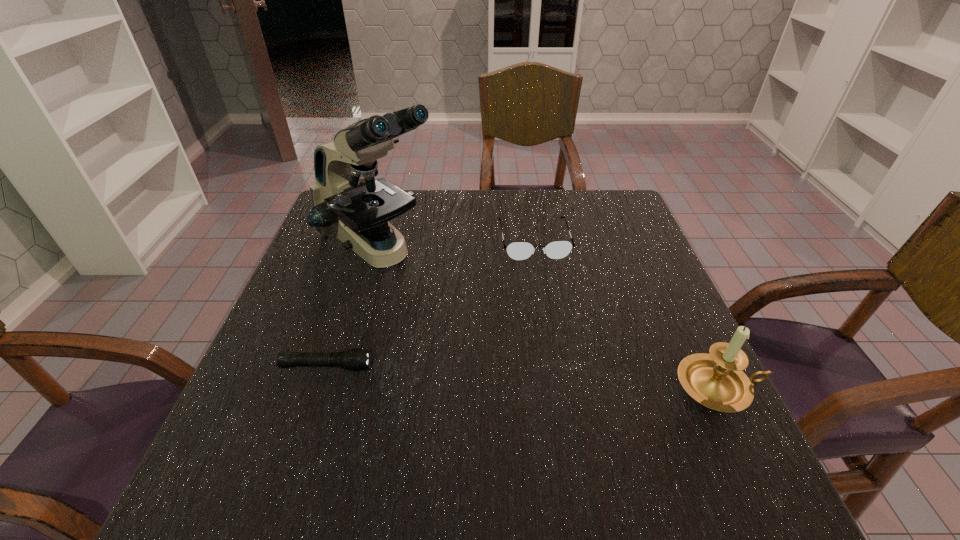
At what (x,y) coordinates should I click in order to perform the action: click on free space located 0.110m through the eyepieces of the tallest object. Please return your answer as a coordinate pair (x, y). Looking at the image, I should click on (446, 305).

Where is `vacant area situated 0.220m through the eyepieces of the tallest object`? The image size is (960, 540). vacant area situated 0.220m through the eyepieces of the tallest object is located at coordinates (479, 331).

The image size is (960, 540). Identify the location of vacant space located through the eyepieces of the tallest object. (486, 336).

Locate an element on the screen. The width and height of the screenshot is (960, 540). spectacles at the far edge is located at coordinates (519, 251).

In order to click on microscope at the far edge in this screenshot , I will do `click(347, 201)`.

What are the coordinates of `object situated at the near edge` in the screenshot? It's located at (716, 380).

You are a GUI agent. You are given a task and a screenshot of the screen. Output one action in this format:
    pyautogui.click(x=<x>, y=<y>)
    Task: Click on the flashlight located in the left edge section of the desktop
    The image size is (960, 540).
    Given the screenshot: What is the action you would take?
    pyautogui.click(x=355, y=359)

The width and height of the screenshot is (960, 540). I want to click on microscope present at the left edge, so click(347, 201).

Identify the location of object at the right edge. (716, 380).

Where is `object located in the far left corner section of the desktop`? object located in the far left corner section of the desktop is located at coordinates (347, 201).